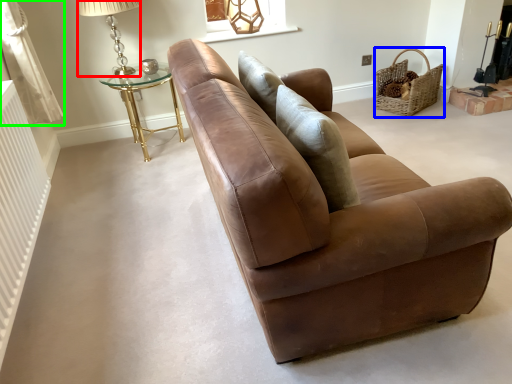
Question: Considering the real-world distances, which object is closest to table lamp (highlighted by a red box)? basket (highlighted by a blue box) or curtain (highlighted by a green box).

Choices:
 (A) basket
 (B) curtain

Answer: (B)